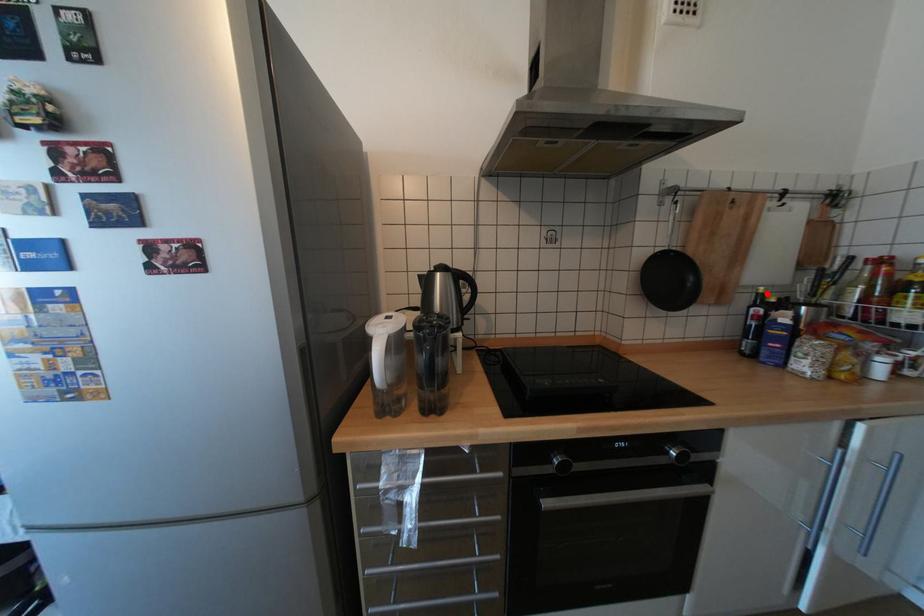
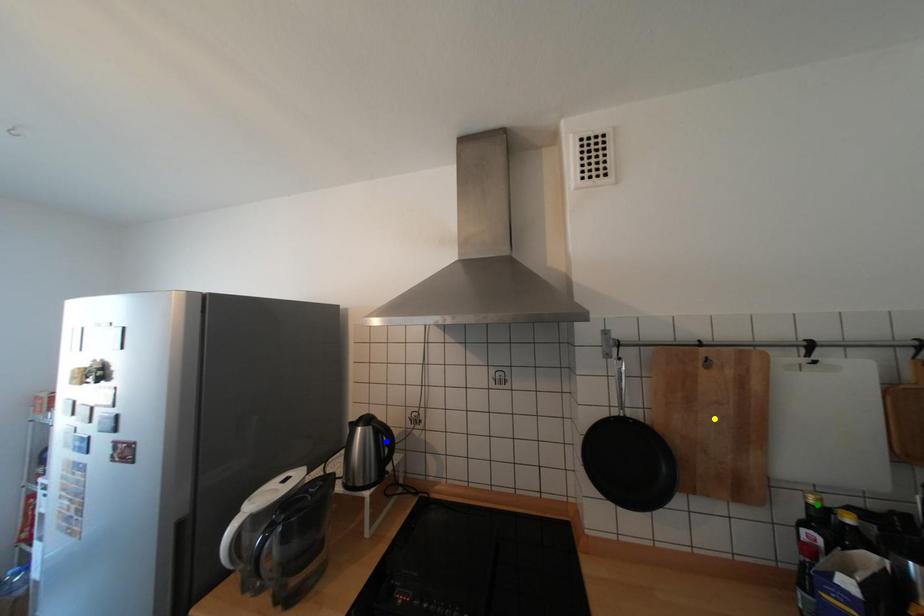
Question: I am providing you with two images of the same scene from different viewpoints. A red point is marked on the first image. You are given multiple points on the second image. Which point in image 2 is actually the same real-world point as the red point in image 1?

Choices:
 (A) green point
 (B) blue point
 (C) yellow point

Answer: (A)